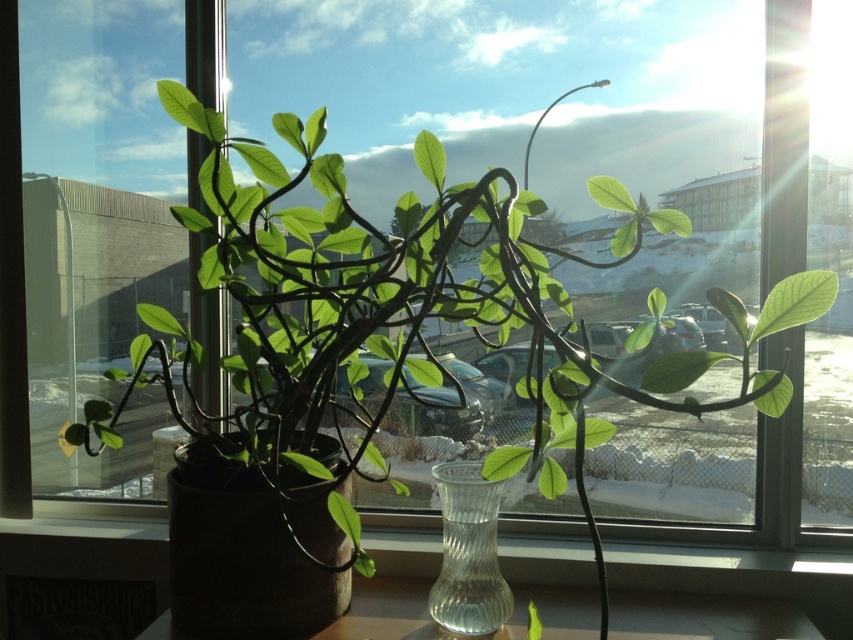
Does matte brown vase at center have a lesser height compared to clear glass vase at center?

Indeed, matte brown vase at center has a lesser height compared to clear glass vase at center.

Find the location of a particular element. This screenshot has height=640, width=853. matte brown vase at center is located at coordinates (727, 570).

Describe the element at coordinates (727, 570) in the screenshot. I see `matte brown vase at center` at that location.

Image resolution: width=853 pixels, height=640 pixels. Identify the location of matte brown vase at center. (x=727, y=570).

Is matte brown vase at center shorter than transparent glass vase at center?

Yes, matte brown vase at center is shorter than transparent glass vase at center.

Can you confirm if matte brown vase at center is positioned to the left of transparent glass vase at center?

No, matte brown vase at center is not to the left of transparent glass vase at center.

In order to click on matte brown vase at center in this screenshot , I will do `click(727, 570)`.

Which is below, transparent glass vase at center or clear glass vase at center?

clear glass vase at center is below.

Who is more distant from viewer, (263, 500) or (479, 572)?

The point (479, 572) is more distant.

The image size is (853, 640). Identify the location of transparent glass vase at center. (239, 556).